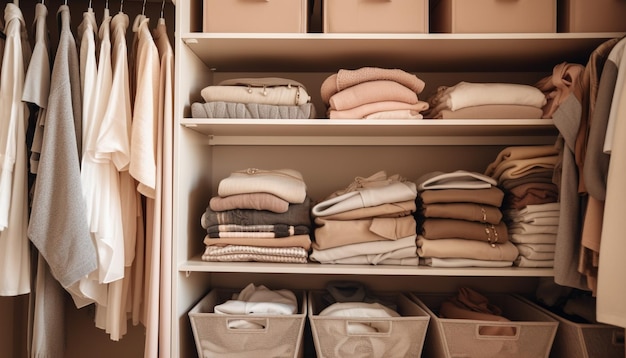
Identify the location of wire top of clothes hangers. The width and height of the screenshot is (626, 358). (43, 2), (67, 3), (90, 2), (106, 5), (123, 6), (141, 7), (160, 6).